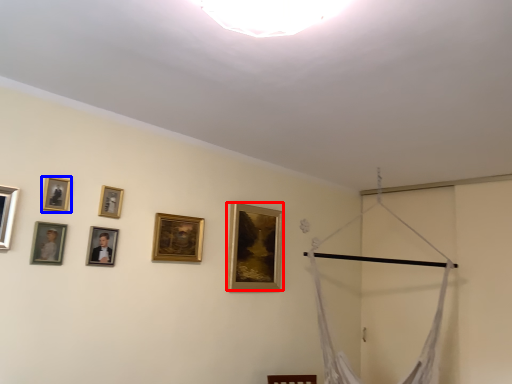
Question: Which point is further to the camera, picture frame (highlighted by a red box) or picture frame (highlighted by a blue box)?

Choices:
 (A) picture frame
 (B) picture frame

Answer: (A)